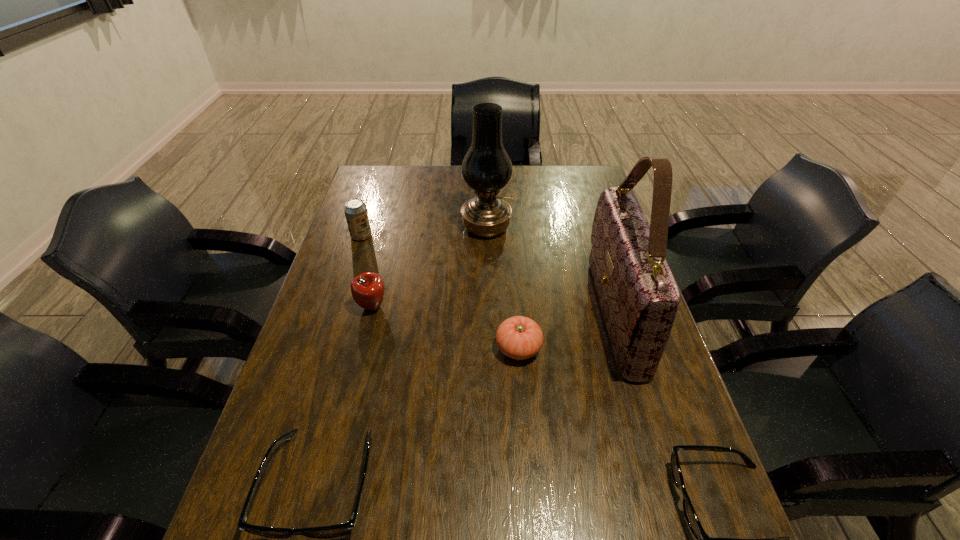
In order to click on oil lamp in this screenshot , I will do `click(486, 168)`.

The image size is (960, 540). I want to click on beer can, so click(355, 210).

Identify the location of tomato. The height and width of the screenshot is (540, 960). (518, 337).

Locate an element on the screen. The height and width of the screenshot is (540, 960). apple is located at coordinates (367, 289).

The image size is (960, 540). I want to click on handbag, so click(638, 295).

I want to click on blank space located 0.220m on the right of the oil lamp, so click(x=576, y=227).

The width and height of the screenshot is (960, 540). Find the location of `vacant region located 0.160m on the back of the beer can`. vacant region located 0.160m on the back of the beer can is located at coordinates (372, 203).

At what (x,y) coordinates should I click in order to perform the action: click on vacant area situated 0.160m on the back of the tomato. Please return your answer as a coordinate pair (x, y). The image size is (960, 540). Looking at the image, I should click on (514, 288).

The height and width of the screenshot is (540, 960). Find the location of `free space located on the back of the apple`. free space located on the back of the apple is located at coordinates (386, 251).

Locate an element on the screen. free location located on the front of the handbag with the clasp is located at coordinates (450, 314).